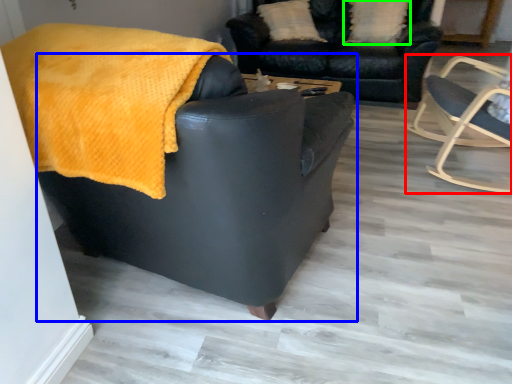
Question: Which object is positioned closest to chair (highlighted by a red box)? Select from chair (highlighted by a blue box) and pillow (highlighted by a green box).

Choices:
 (A) chair
 (B) pillow

Answer: (B)